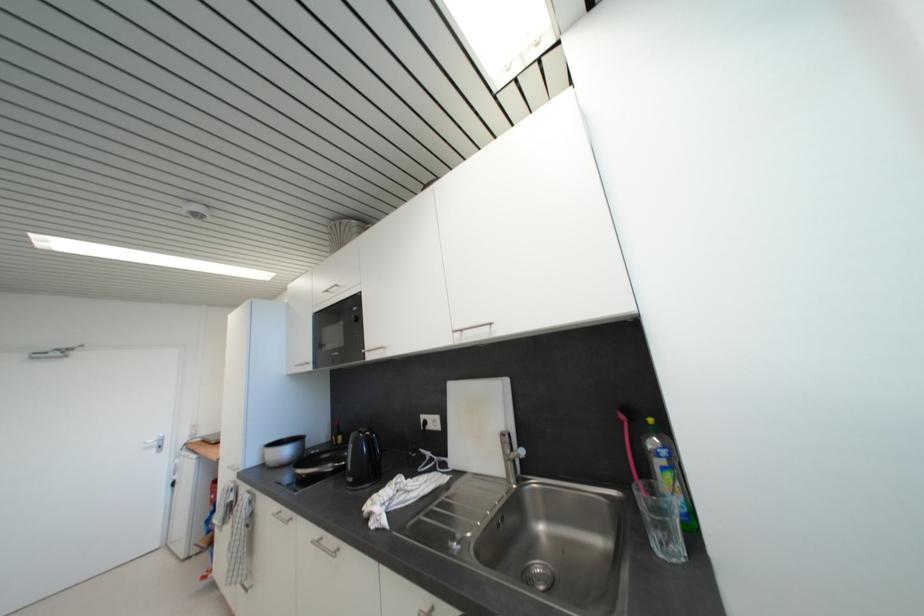
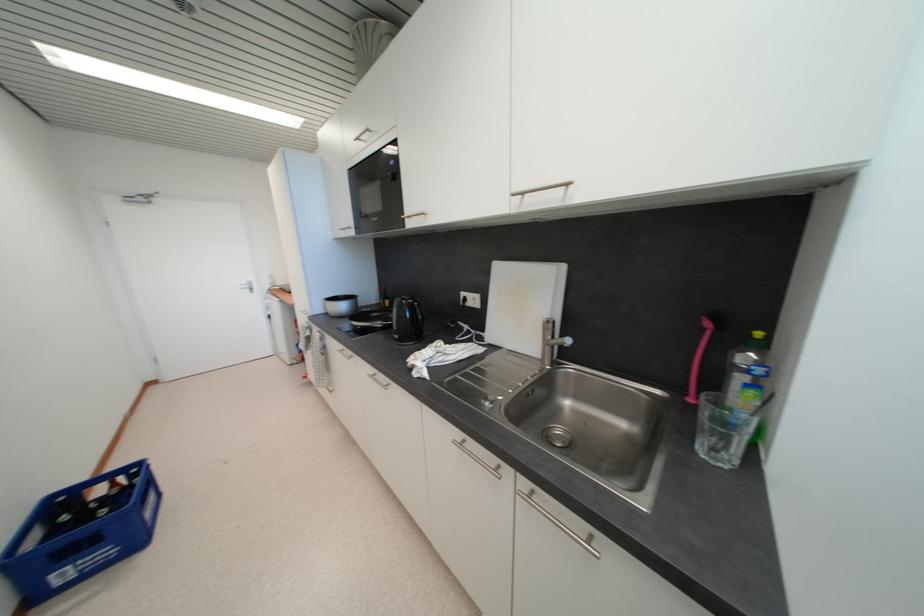
Find the pixel in the second image that matches pixel 627 419 in the first image.

(713, 326)